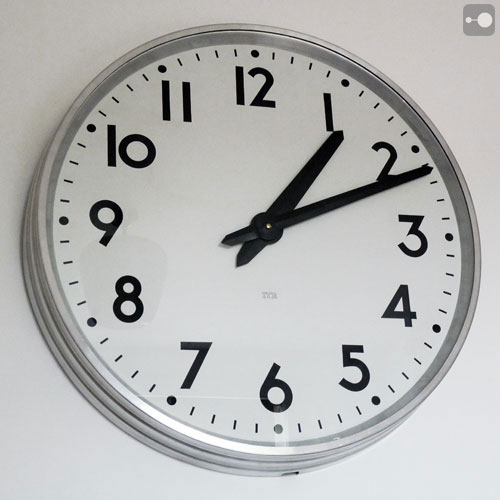
Identify the location of silver clock body. (125, 406).